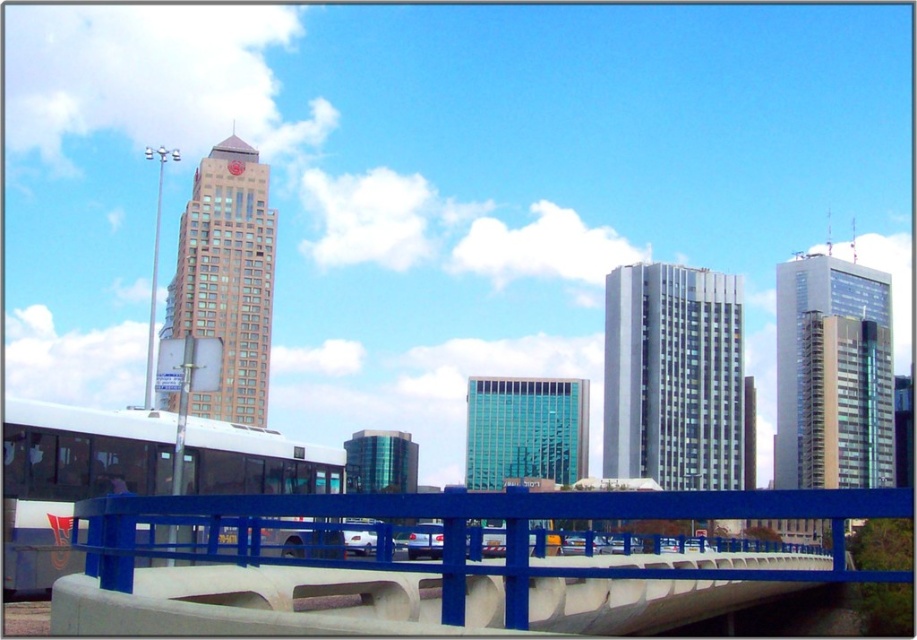
Question: Is the position of blue metallic pedestrian bridge at center less distant than that of beige glass tower at upper left?

Choices:
 (A) no
 (B) yes

Answer: (B)

Question: Which of these objects is positioned closest to the silver glass skyscraper at center?

Choices:
 (A) blue metallic pedestrian bridge at center
 (B) beige glass tower at upper left

Answer: (B)

Question: Which of the following is the closest to the observer?

Choices:
 (A) (855, 272)
 (B) (686, 301)
 (C) (260, 266)
 (D) (818, 572)

Answer: (D)

Question: Can you confirm if silver glass skyscraper at center is positioned to the left of beige glass tower at upper left?

Choices:
 (A) no
 (B) yes

Answer: (A)

Question: Estimate the real-world distances between objects in this image. Which object is farther from the silver glass skyscraper at center?

Choices:
 (A) silver glass skyscraper at right
 (B) blue metallic pedestrian bridge at center

Answer: (B)

Question: Is silver glass skyscraper at center bigger than silver glass skyscraper at right?

Choices:
 (A) yes
 (B) no

Answer: (B)